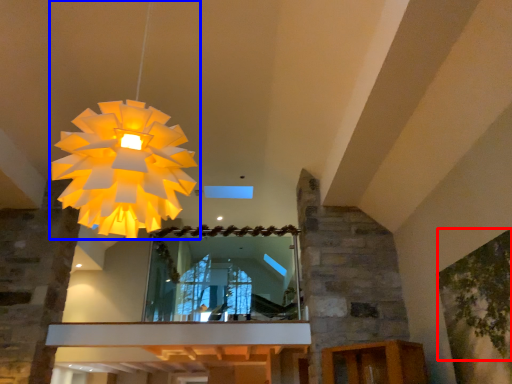
Question: Which point is further to the camera, tree (highlighted by a red box) or lamp (highlighted by a blue box)?

Choices:
 (A) tree
 (B) lamp

Answer: (A)